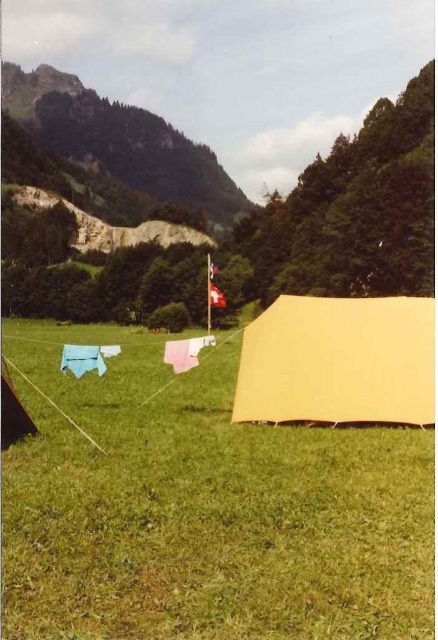
You are a hiker who just arrived at the campsite and need to set up your tent. You are currently standing 6.30 feet away from the yellow fabric tent at right. Is there enough space between you and the tent to comfortably set up another tent?

The distance between you and the yellow fabric tent at right is 6.30 feet, which is sufficient space to comfortably set up another tent.

You are a hiker who wants to set up a tent near the blue fabric at lower left. You see the yellow fabric tent at right in the distance. Which object is closer to you, the hiker, when you are standing at the starting point?

The yellow fabric tent at right is closer to the viewer than the blue fabric at lower left, so the yellow fabric tent at right is closer to you when you are standing at the starting point.

You are planning to set up a tent in this camping area and need to know which object occupies more space. Which is larger between the yellow fabric tent at right and the red fabric flag at center?

The yellow fabric tent at right is bigger than the red fabric flag at center according to the description.